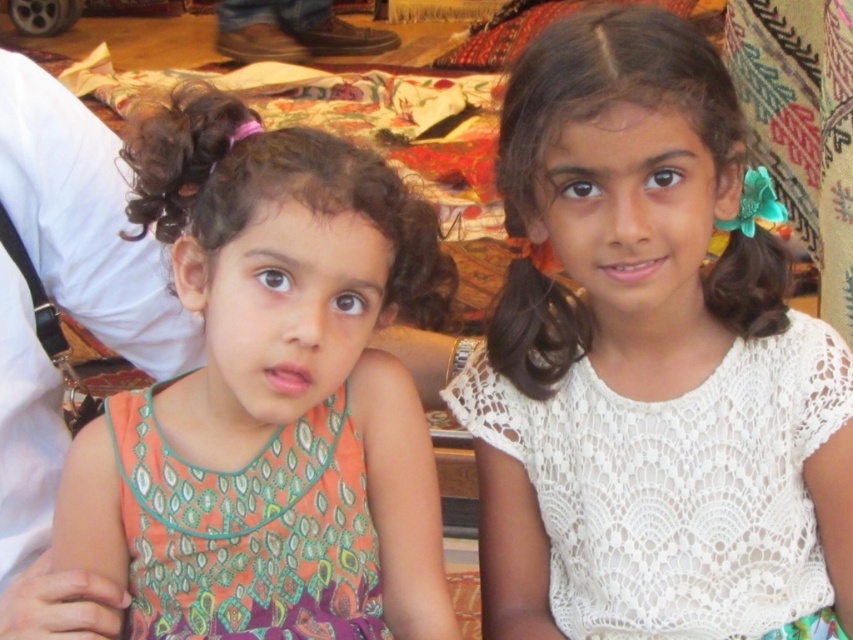
Is orange printed dress at left below white lace dress at center?

No, orange printed dress at left is not below white lace dress at center.

Is orange printed dress at left bigger than white lace dress at center?

Correct, orange printed dress at left is larger in size than white lace dress at center.

Does point (213, 388) come behind point (747, 436)?

No, it is in front of (747, 436).

I want to click on orange printed dress at left, so click(x=270, y=396).

Does white lace dress at center have a smaller size compared to printed fabric dress at left?

No, white lace dress at center is not smaller than printed fabric dress at left.

Is white lace dress at center thinner than printed fabric dress at left?

In fact, white lace dress at center might be wider than printed fabric dress at left.

Between point (790, 593) and point (345, 454), which one is positioned in front?

Point (345, 454) is more forward.

Locate an element on the screen. white lace dress at center is located at coordinates pyautogui.click(x=677, y=486).

Does orange printed dress at left appear on the right side of printed fabric dress at left?

Correct, you'll find orange printed dress at left to the right of printed fabric dress at left.

Does orange printed dress at left have a larger size compared to printed fabric dress at left?

Yes, orange printed dress at left is bigger than printed fabric dress at left.

Where is `orange printed dress at left`? Image resolution: width=853 pixels, height=640 pixels. orange printed dress at left is located at coordinates (270, 396).